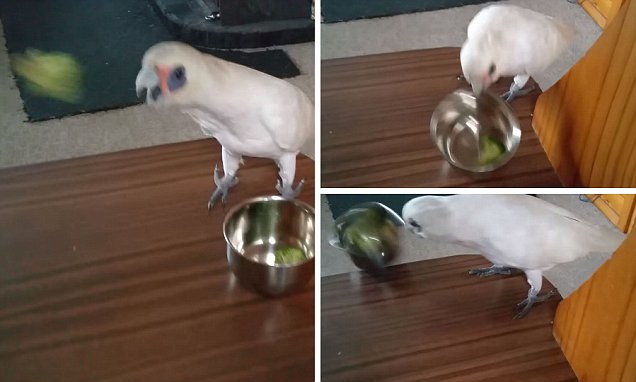
The height and width of the screenshot is (382, 636). What are the coordinates of `small bowl` in the screenshot? It's located at (259, 277).